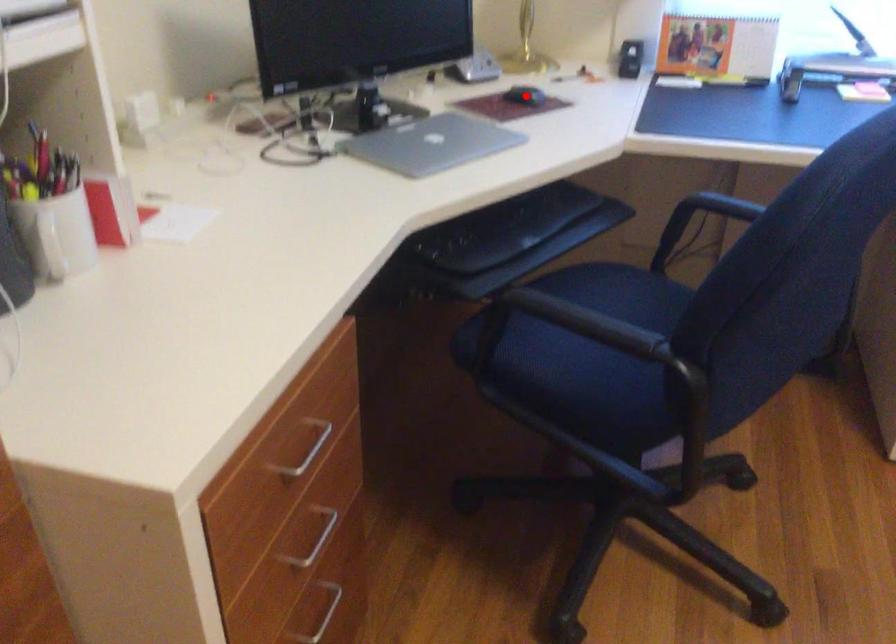
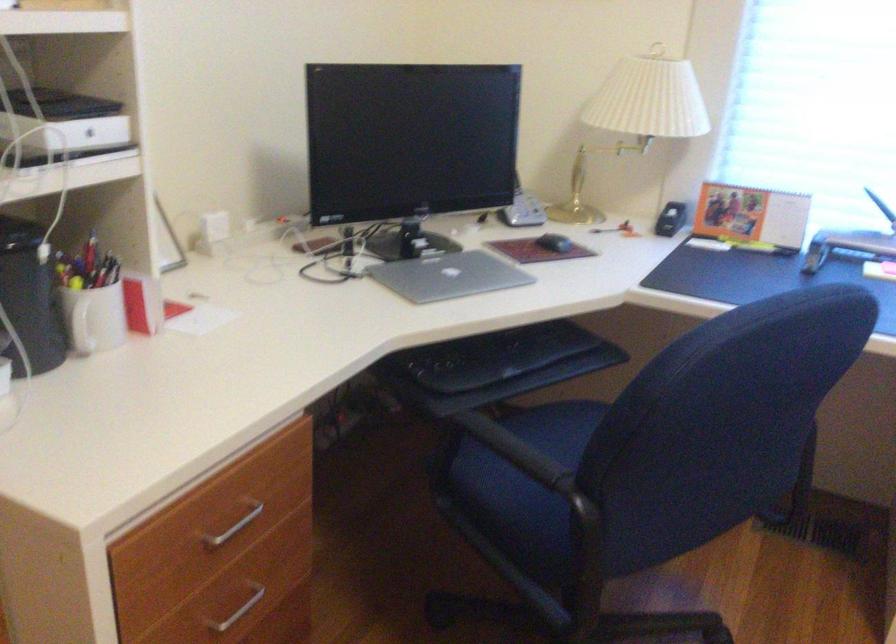
Question: I am providing you with two images of the same scene from different viewpoints. A red point is shown in image1. For the corresponding object point in image2, is it positioned nearer or farther from the camera?

Choices:
 (A) Nearer
 (B) Farther

Answer: (B)